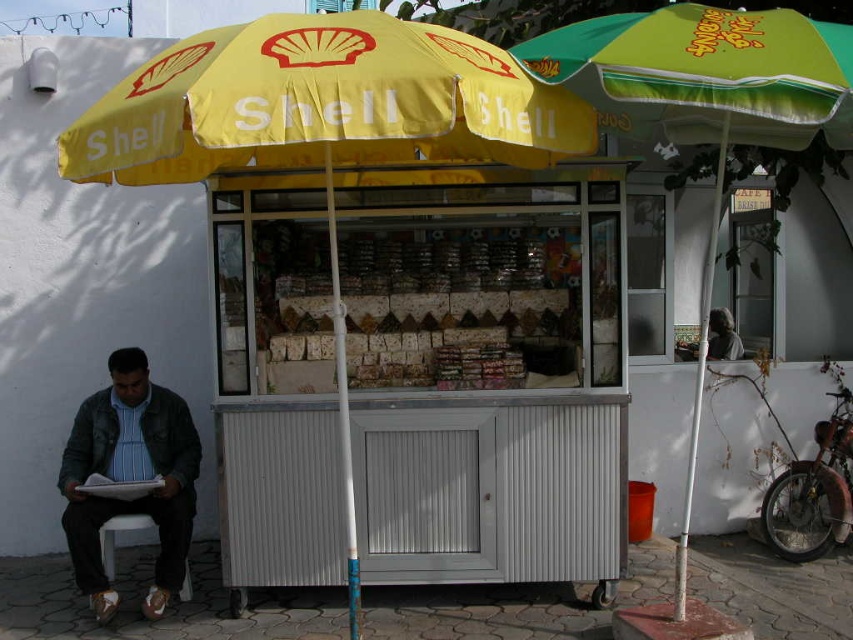
Question: Which is nearer to the denim jacket at lower left?

Choices:
 (A) green fabric umbrella at upper right
 (B) yellow fabric umbrella at center

Answer: (B)

Question: Which point is farther from the camera taking this photo?

Choices:
 (A) (102, 529)
 (B) (136, 179)
 (C) (848, 145)
 (D) (165, 492)

Answer: (D)

Question: Can you confirm if yellow fabric umbrella at center is wider than white plastic stool at lower left?

Choices:
 (A) yes
 (B) no

Answer: (A)

Question: Which of these objects is positioned farthest from the white plastic stool at lower left?

Choices:
 (A) denim jacket at lower left
 (B) yellow fabric umbrella at center

Answer: (B)

Question: Is yellow fabric umbrella at center positioned behind white plastic stool at lower left?

Choices:
 (A) yes
 (B) no

Answer: (B)

Question: Can you confirm if denim jacket at lower left is positioned above white plastic stool at lower left?

Choices:
 (A) no
 (B) yes

Answer: (B)